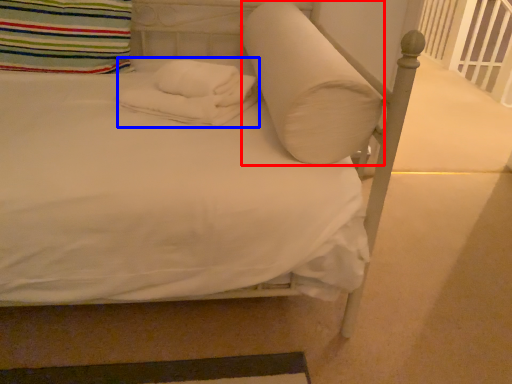
Question: Which of the following is the farthest to the observer, pillow (highlighted by a red box) or material (highlighted by a blue box)?

Choices:
 (A) pillow
 (B) material

Answer: (B)